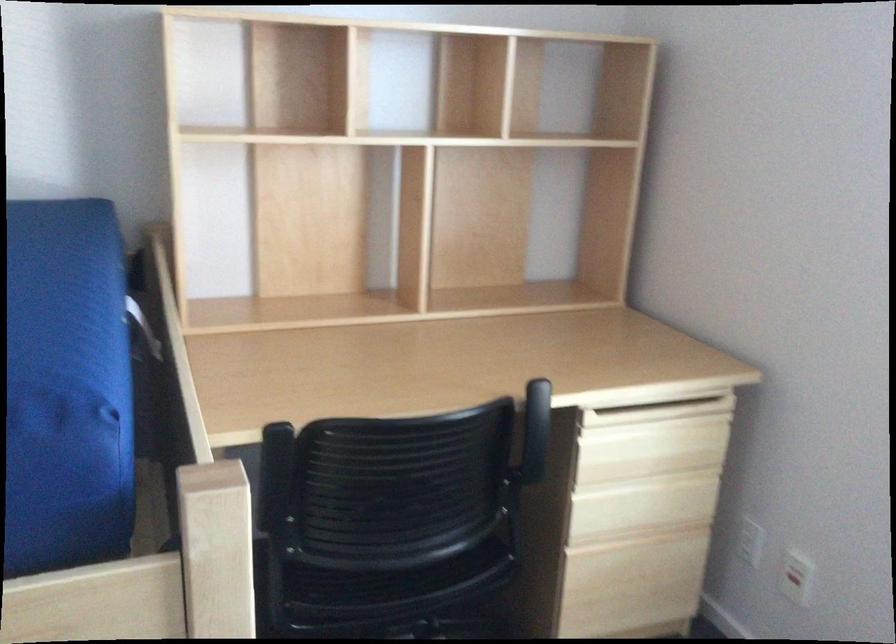
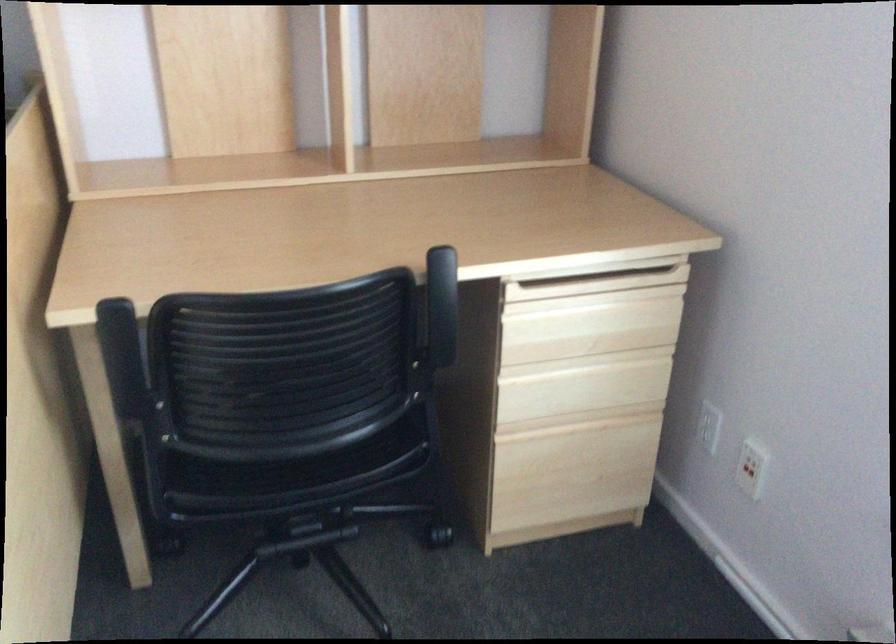
In the second image, find the point that corresponds to (273,478) in the first image.

(123, 360)